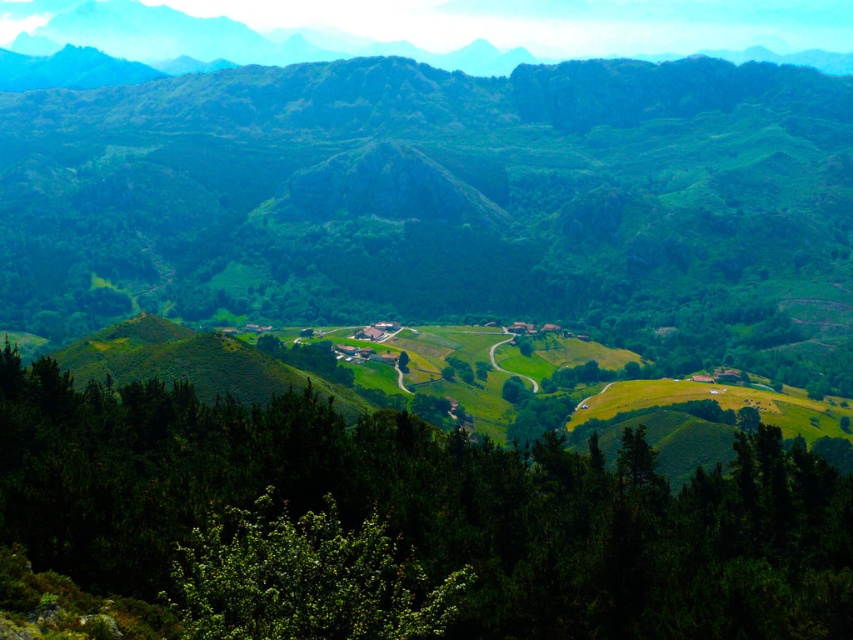
Does point (532, 477) come behind point (207, 608)?

Yes, it is behind point (207, 608).

Can you confirm if green matte tree at center is positioned above green leafy bush at lower center?

No.

Is point (78, 548) positioned after point (235, 596)?

Yes.

Locate an element on the screen. green matte tree at center is located at coordinates (433, 509).

Is the position of green textured mountains at upper center less distant than that of green leafy tree at center?

No.

Can you confirm if green textured mountains at upper center is positioned above green leafy tree at center?

Indeed, green textured mountains at upper center is positioned over green leafy tree at center.

Between point (466, 61) and point (398, 365), which one is positioned behind?

The point (466, 61) is more distant.

Identify the location of green textured mountains at upper center. (216, 38).

Is green leafy bush at lower center behind green textured mountains at upper center?

That is False.

Between green leafy bush at lower center and green textured mountains at upper center, which one appears on the right side from the viewer's perspective?

From the viewer's perspective, green leafy bush at lower center appears more on the right side.

This screenshot has width=853, height=640. I want to click on green leafy bush at lower center, so click(x=305, y=579).

Locate an element on the screen. The height and width of the screenshot is (640, 853). green leafy bush at lower center is located at coordinates (305, 579).